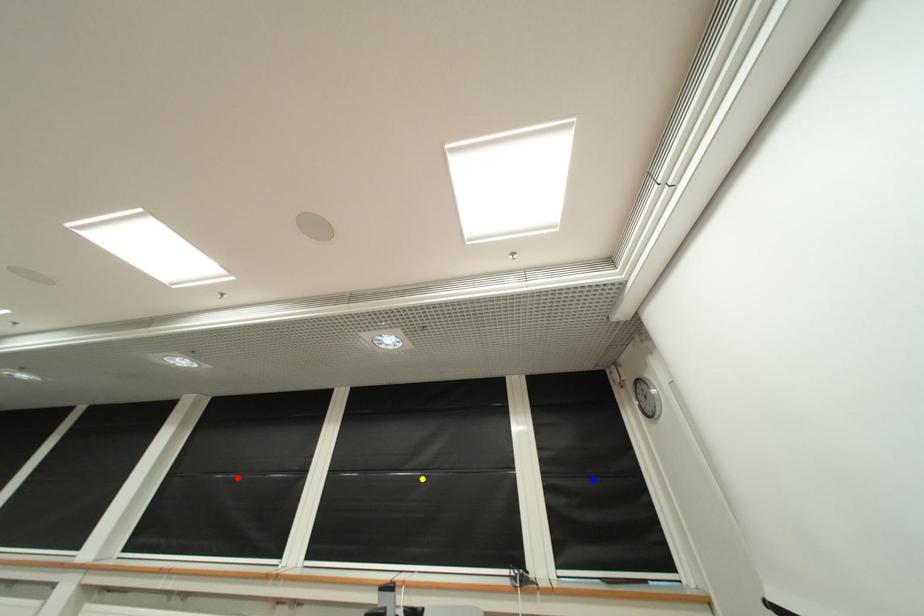
Order these from nearest to farthest:
blue point
red point
yellow point

blue point
yellow point
red point